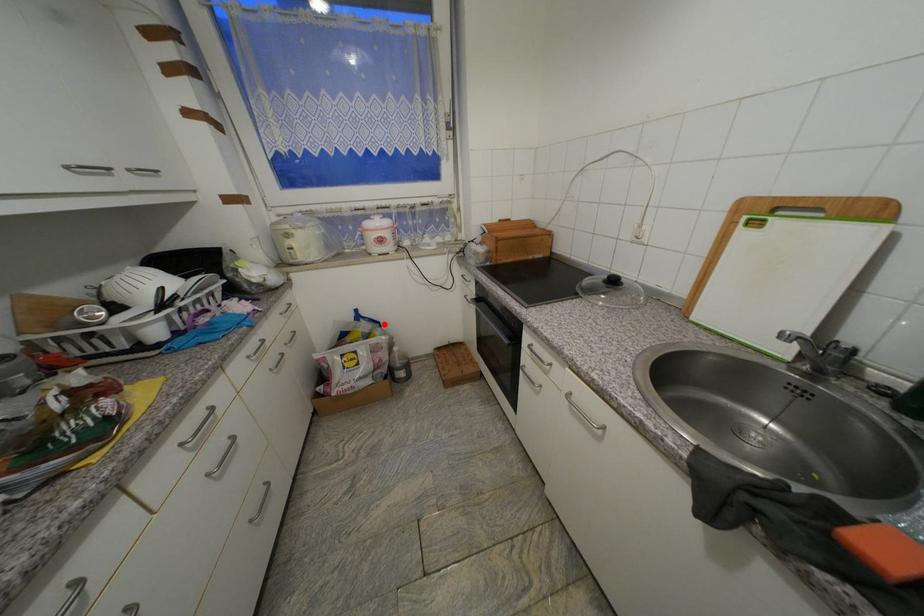
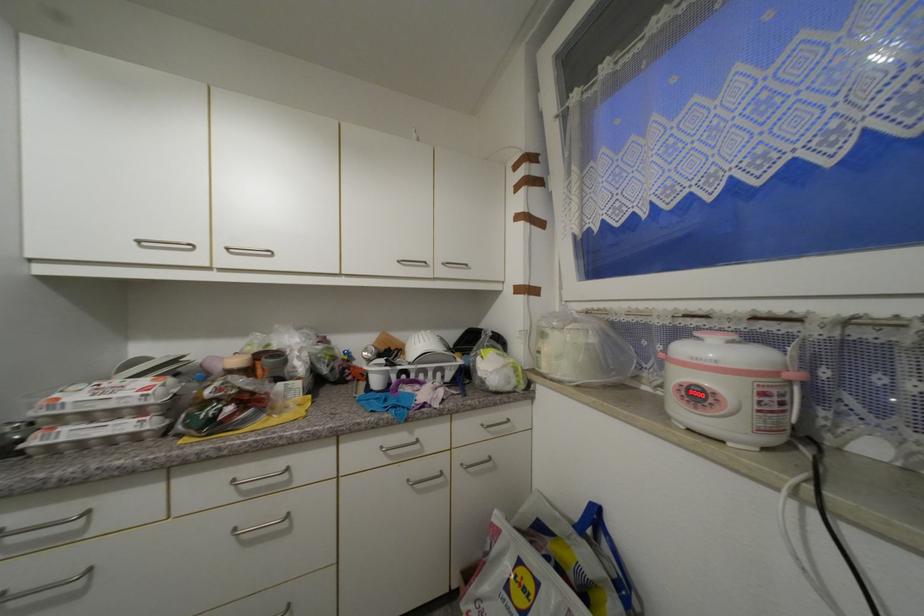
Question: I am providing you with two images of the same scene from different viewpoints. In image1, a red point is highlighted. Considering the same 3D point in image2, which of the following is correct?

Choices:
 (A) It is closer
 (B) It is farther

Answer: (A)